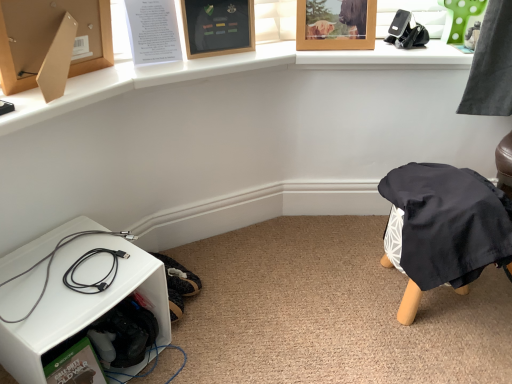
In order to face white plastic shelf at lower left, should I rotate leftwards or rightwards?

To face it directly, rotate left by 22.890 degrees.

You are a GUI agent. You are given a task and a screenshot of the screen. Output one action in this format:
    pyautogui.click(x=<x>, y=<y>)
    Task: Click on the wooden picture frame at upper center, the first picture frame when ordered from right to left
    This screenshot has width=512, height=384.
    Given the screenshot: What is the action you would take?
    pyautogui.click(x=338, y=27)

Image resolution: width=512 pixels, height=384 pixels. Describe the element at coordinates (338, 27) in the screenshot. I see `wooden picture frame at upper center, the first picture frame when ordered from right to left` at that location.

You are a GUI agent. You are given a task and a screenshot of the screen. Output one action in this format:
    pyautogui.click(x=<x>, y=<y>)
    Task: Click on the white plastic shelf at lower left
    The image size is (512, 384).
    Given the screenshot: What is the action you would take?
    pyautogui.click(x=81, y=306)

From the image's perspective, would you say white plastic shelf at lower left is positioned over black plastic phone holder at upper right?

Actually, white plastic shelf at lower left appears below black plastic phone holder at upper right in the image.

In terms of height, does white plastic shelf at lower left look taller or shorter compared to black plastic phone holder at upper right?

Considering their sizes, white plastic shelf at lower left has more height than black plastic phone holder at upper right.

Is white plastic shelf at lower left positioned beyond the bounds of black plastic phone holder at upper right?

Yes, white plastic shelf at lower left is not within black plastic phone holder at upper right.

Considering their positions, is white plastic shelf at lower left located in front of or behind black plastic phone holder at upper right?

Clearly, white plastic shelf at lower left is in front of black plastic phone holder at upper right.

How different are the orientations of wooden picture frame at upper center, the first picture frame positioned from the left, and wooden picture frame at upper center, the first picture frame when ordered from right to left, in degrees?

They differ by 23.7 degrees in their facing directions.

Consider the image. Is wooden picture frame at upper center, the first picture frame positioned from the left, not close to wooden picture frame at upper center, the first picture frame when ordered from right to left?

No, wooden picture frame at upper center, the first picture frame positioned from the left, is not far from wooden picture frame at upper center, the first picture frame when ordered from right to left.

Between wooden picture frame at upper center, the first picture frame positioned from the left, and wooden picture frame at upper center, the first picture frame when ordered from right to left, which one has larger size?

wooden picture frame at upper center, the first picture frame when ordered from right to left.

Is point (226, 10) closer or farther from the camera than point (349, 43)?

Point (226, 10).

Choose the correct answer: Is black plastic phone holder at upper right inside white plastic shelf at lower left or outside it?

black plastic phone holder at upper right lies outside white plastic shelf at lower left.

Could you tell me if black plastic phone holder at upper right is turned towards white plastic shelf at lower left?

No, black plastic phone holder at upper right is not aimed at white plastic shelf at lower left.

From the image's perspective, relative to white plastic shelf at lower left, is black plastic phone holder at upper right above or below?

Clearly, from the image's perspective, black plastic phone holder at upper right is above white plastic shelf at lower left.

Between black plastic phone holder at upper right and white plastic shelf at lower left, which one has less height?

black plastic phone holder at upper right.

Measure the distance from wooden picture frame at upper center, the first picture frame positioned from the left, to white plastic shelf at lower left.

The distance of wooden picture frame at upper center, the first picture frame positioned from the left, from white plastic shelf at lower left is 28.75 inches.

Between point (234, 9) and point (84, 307), which one is positioned behind?

The point (234, 9) is farther from the camera.

From the picture: Which of these two, wooden picture frame at upper center, the first picture frame positioned from the left, or white plastic shelf at lower left, is smaller?

wooden picture frame at upper center, the first picture frame positioned from the left.

Consider the image. Would you say wooden picture frame at upper center, the first picture frame positioned from the left, is inside or outside white plastic shelf at lower left?

wooden picture frame at upper center, the first picture frame positioned from the left, is located beyond the bounds of white plastic shelf at lower left.

From the image's perspective, is black cable at lower left on top of wooden picture frame at upper center, the first picture frame when ordered from right to left?

Actually, black cable at lower left appears below wooden picture frame at upper center, the first picture frame when ordered from right to left, in the image.

Is black cable at lower left inside or outside of wooden picture frame at upper center, positioned as the 2th picture frame in left-to-right order?

black cable at lower left is located beyond the bounds of wooden picture frame at upper center, positioned as the 2th picture frame in left-to-right order.

Considering the points (135, 237) and (353, 49), which point is behind, point (135, 237) or point (353, 49)?

The point (135, 237) is farther.

Would you say white plastic shelf at lower left is a long distance from wooden picture frame at upper center, the first picture frame positioned from the left?

That's not correct — white plastic shelf at lower left is a little close to wooden picture frame at upper center, the first picture frame positioned from the left.

Looking at this image, which of these two, white plastic shelf at lower left or wooden picture frame at upper center, the first picture frame positioned from the left, is bigger?

white plastic shelf at lower left is bigger.

Find the location of a particular element. The width and height of the screenshot is (512, 384). furniture in front of the wooden picture frame at upper center, the 2th picture frame when ordered from right to left is located at coordinates (81, 306).

From their relative heights in the image, would you say white plastic shelf at lower left is taller or shorter than wooden picture frame at upper center, the first picture frame positioned from the left?

white plastic shelf at lower left is taller than wooden picture frame at upper center, the first picture frame positioned from the left.

Is wooden picture frame at upper center, the first picture frame when ordered from right to left, oriented away from wooden picture frame at upper center, the first picture frame positioned from the left?

No, wooden picture frame at upper center, the first picture frame positioned from the left, is not at the back of wooden picture frame at upper center, the first picture frame when ordered from right to left.

Does wooden picture frame at upper center, positioned as the 2th picture frame in left-to-right order, have a smaller size compared to wooden picture frame at upper center, the first picture frame positioned from the left?

Actually, wooden picture frame at upper center, positioned as the 2th picture frame in left-to-right order, might be larger than wooden picture frame at upper center, the first picture frame positioned from the left.

Which object is wider, wooden picture frame at upper center, positioned as the 2th picture frame in left-to-right order, or wooden picture frame at upper center, the first picture frame positioned from the left?

wooden picture frame at upper center, positioned as the 2th picture frame in left-to-right order.

You are a GUI agent. You are given a task and a screenshot of the screen. Output one action in this format:
    pyautogui.click(x=<x>, y=<y>)
    Task: Click on the window frame on the right of white plastic shelf at lower left
    Image resolution: width=512 pixels, height=384 pixels.
    Given the screenshot: What is the action you would take?
    pyautogui.click(x=413, y=15)

You are a GUI agent. You are given a task and a screenshot of the screen. Output one action in this format:
    pyautogui.click(x=<x>, y=<y>)
    Task: Click on the picture frame that appears below the wooden picture frame at upper center, the first picture frame when ordered from right to left (from the image's perspective)
    The image size is (512, 384).
    Given the screenshot: What is the action you would take?
    pyautogui.click(x=218, y=27)

Which object lies nearer to the anchor point wooden picture frame at upper center, the first picture frame positioned from the left, black cable at lower left or white plastic shelf at lower left?

Among the two, black cable at lower left is located nearer to wooden picture frame at upper center, the first picture frame positioned from the left.

Considering their positions, is black cable at lower left positioned further to wooden picture frame at upper center, the first picture frame when ordered from right to left, than wooden picture frame at upper center, the 2th picture frame when ordered from right to left?

black cable at lower left lies further to wooden picture frame at upper center, the first picture frame when ordered from right to left, than the other object.

When comparing their distances from wooden picture frame at upper center, the first picture frame positioned from the left, does white plastic shelf at lower left or black cable at lower left seem further?

Based on the image, white plastic shelf at lower left appears to be further to wooden picture frame at upper center, the first picture frame positioned from the left.

Based on their spatial positions, is black cable at lower left or black plastic phone holder at upper right closer to wooden picture frame at upper center, positioned as the 2th picture frame in left-to-right order?

The object closer to wooden picture frame at upper center, positioned as the 2th picture frame in left-to-right order, is black plastic phone holder at upper right.

Which object lies nearer to the anchor point white plastic shelf at lower left, black plastic phone holder at upper right or wooden picture frame at upper center, the first picture frame positioned from the left?

wooden picture frame at upper center, the first picture frame positioned from the left, lies closer to white plastic shelf at lower left than the other object.

Looking at the image, which one is located further to black cable at lower left, wooden picture frame at upper center, the 2th picture frame when ordered from right to left, or wooden picture frame at upper center, positioned as the 2th picture frame in left-to-right order?

The object further to black cable at lower left is wooden picture frame at upper center, positioned as the 2th picture frame in left-to-right order.

From the image, which object appears to be nearer to wooden picture frame at upper center, the 2th picture frame when ordered from right to left, wooden picture frame at upper center, positioned as the 2th picture frame in left-to-right order, or white plastic shelf at lower left?

wooden picture frame at upper center, positioned as the 2th picture frame in left-to-right order, lies closer to wooden picture frame at upper center, the 2th picture frame when ordered from right to left, than the other object.

Looking at the image, which one is located further to black plastic phone holder at upper right, white plastic shelf at lower left or wooden picture frame at upper center, the first picture frame when ordered from right to left?

Based on the image, white plastic shelf at lower left appears to be further to black plastic phone holder at upper right.

Locate an element on the screen. picture frame between wooden picture frame at upper center, the 2th picture frame when ordered from right to left, and black plastic phone holder at upper right is located at coordinates tap(338, 27).

Identify the location of furniture situated between black cable at lower left and black plastic phone holder at upper right from left to right. (81, 306).

You are a GUI agent. You are given a task and a screenshot of the screen. Output one action in this format:
    pyautogui.click(x=<x>, y=<y>)
    Task: Click on the picture frame between wooden picture frame at upper center, the first picture frame when ordered from right to left, and white plastic shelf at lower left vertically
    The height and width of the screenshot is (384, 512).
    Given the screenshot: What is the action you would take?
    pyautogui.click(x=218, y=27)

At what (x,y) coordinates should I click in order to perform the action: click on wire between wooden picture frame at upper center, the first picture frame when ordered from right to left, and white plastic shelf at lower left, in the vertical direction. Please return your answer as a coordinate pair (x, y). Image resolution: width=512 pixels, height=384 pixels. Looking at the image, I should click on (52, 261).